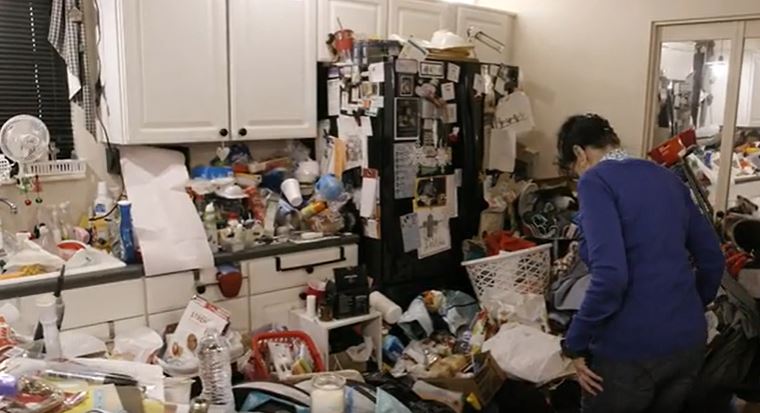
Identify the location of fan. This screenshot has height=413, width=760. (33, 140).